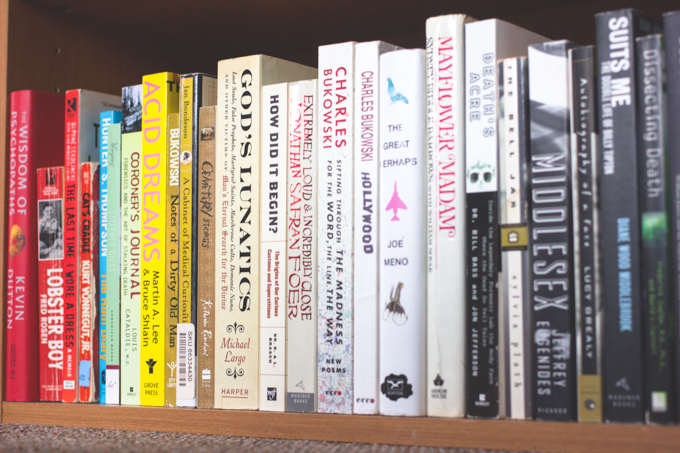
This screenshot has width=680, height=453. In order to click on books with mostly white spines in this screenshot , I will do `click(238, 222)`, `click(267, 233)`, `click(300, 227)`, `click(343, 221)`, `click(367, 216)`, `click(396, 205)`, `click(443, 205)`, `click(511, 201)`.